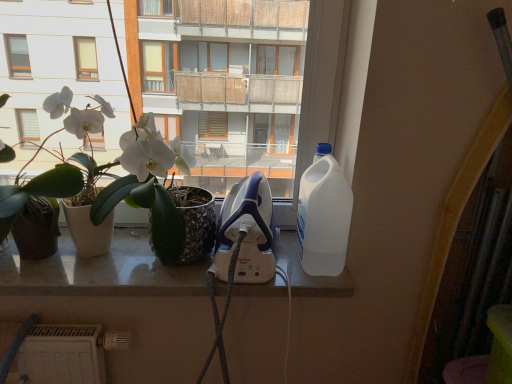
Question: Can you confirm if white matte plant pot at left, acting as the second houseplant starting from the left, is bigger than white plastic bottle at right?

Choices:
 (A) no
 (B) yes

Answer: (B)

Question: From the image's perspective, is white matte plant pot at left, acting as the second houseplant starting from the left, located above white plastic bottle at right?

Choices:
 (A) no
 (B) yes

Answer: (B)

Question: Are white matte plant pot at left, which is the 1th houseplant from right to left, and white plastic bottle at right located far from each other?

Choices:
 (A) no
 (B) yes

Answer: (A)

Question: Can you confirm if white matte plant pot at left, which is the 1th houseplant from right to left, is smaller than white plastic bottle at right?

Choices:
 (A) yes
 (B) no

Answer: (B)

Question: Considering the relative sizes of white matte plant pot at left, acting as the second houseplant starting from the left, and white plastic bottle at right in the image provided, is white matte plant pot at left, acting as the second houseplant starting from the left, taller than white plastic bottle at right?

Choices:
 (A) yes
 (B) no

Answer: (A)

Question: In the image, is white matte plant pot at left, acting as the second houseplant starting from the left, positioned in front of or behind green matte plant at left, placed as the second houseplant when sorted from right to left?

Choices:
 (A) front
 (B) behind

Answer: (B)

Question: Considering the relative positions of white matte plant pot at left, which is the 1th houseplant from right to left, and green matte plant at left, the 1th houseplant in the left-to-right sequence, in the image provided, is white matte plant pot at left, which is the 1th houseplant from right to left, to the left or to the right of green matte plant at left, the 1th houseplant in the left-to-right sequence,?

Choices:
 (A) left
 (B) right

Answer: (B)

Question: Is white matte plant pot at left, which is the 1th houseplant from right to left, bigger or smaller than green matte plant at left, the 1th houseplant in the left-to-right sequence?

Choices:
 (A) big
 (B) small

Answer: (A)

Question: Looking at their shapes, would you say white matte plant pot at left, which is the 1th houseplant from right to left, is wider or thinner than green matte plant at left, the 1th houseplant in the left-to-right sequence?

Choices:
 (A) wide
 (B) thin

Answer: (B)

Question: In terms of width, does white matte plant pot at left, acting as the second houseplant starting from the left, look wider or thinner when compared to white plastic bottle at right?

Choices:
 (A) thin
 (B) wide

Answer: (A)

Question: Would you say white matte plant pot at left, which is the 1th houseplant from right to left, is to the left or to the right of white plastic bottle at right in the picture?

Choices:
 (A) right
 (B) left

Answer: (B)

Question: From the image's perspective, is white matte plant pot at left, acting as the second houseplant starting from the left, positioned above or below white plastic bottle at right?

Choices:
 (A) above
 (B) below

Answer: (A)

Question: Is white matte plant pot at left, which is the 1th houseplant from right to left, inside or outside of white plastic bottle at right?

Choices:
 (A) outside
 (B) inside

Answer: (A)

Question: Is green matte plant at left, the 1th houseplant in the left-to-right sequence, wider or thinner than white glossy iron at center?

Choices:
 (A) wide
 (B) thin

Answer: (B)

Question: Is green matte plant at left, the 1th houseplant in the left-to-right sequence, in front of or behind white glossy iron at center in the image?

Choices:
 (A) behind
 (B) front

Answer: (B)